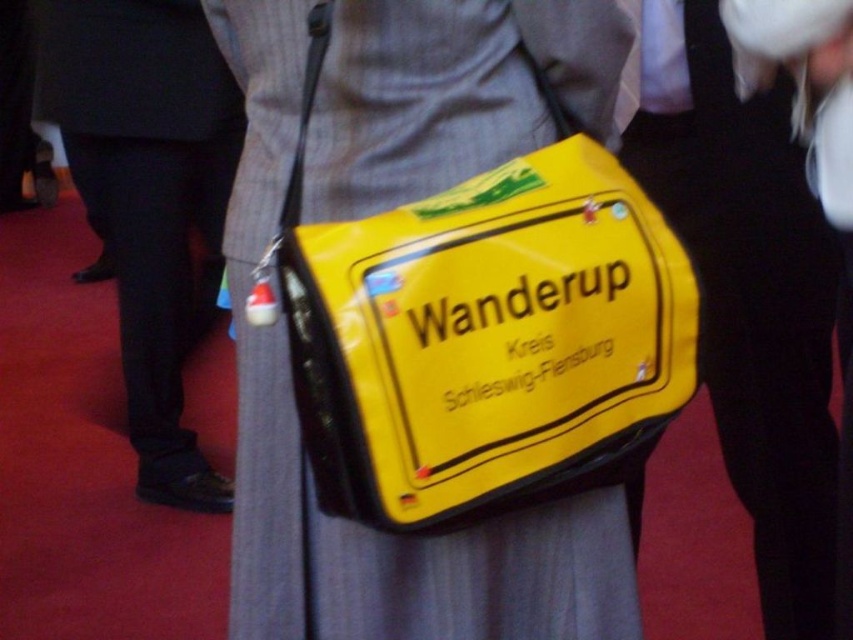
Does point (238, 496) come farther from viewer compared to point (701, 220)?

No, it is in front of (701, 220).

Find the location of a particular element. yellow matte bag at center is located at coordinates (310, 468).

Does point (320, 593) come in front of point (726, 372)?

Yes, point (320, 593) is closer to viewer.

What are the coordinates of `yellow matte bag at center` in the screenshot? It's located at (310, 468).

Is matte black bag at center further to the viewer compared to black leather pants at left?

No, it is in front of black leather pants at left.

Is point (733, 394) farther from camera compared to point (161, 294)?

No, it is not.

I want to click on matte black bag at center, so click(747, 291).

What do you see at coordinates (310, 468) in the screenshot? This screenshot has width=853, height=640. I see `yellow matte bag at center` at bounding box center [310, 468].

Between point (248, 129) and point (173, 61), which one is positioned in front?

Point (248, 129) is more forward.

Find the location of `yellow matte bag at center`. yellow matte bag at center is located at coordinates (310, 468).